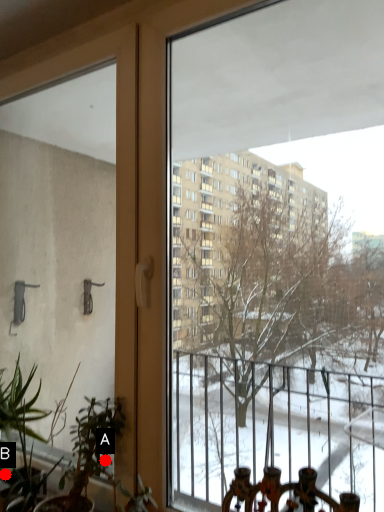
Question: Two points are circled on the image, labeled by A and B beside each circle. Which point is closer to the camera taking this photo?

Choices:
 (A) A is closer
 (B) B is closer

Answer: (A)